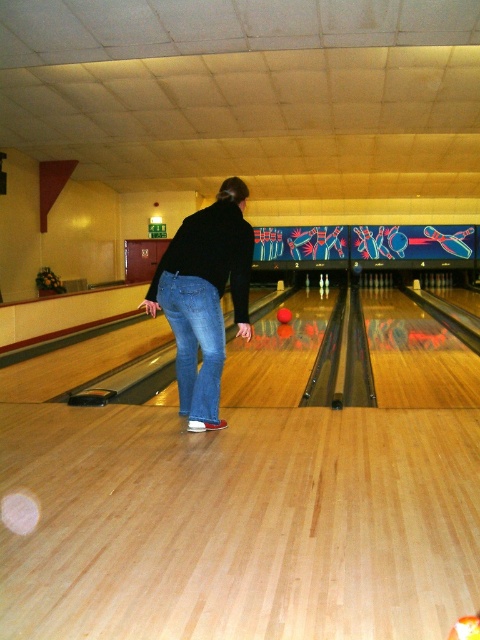
Does jeans at center appear over denim jeans at center?

Indeed, jeans at center is positioned over denim jeans at center.

Who is positioned more to the left, jeans at center or denim jeans at center?

denim jeans at center

Does point (205, 422) lie behind point (187, 339)?

No.

Locate an element on the screen. jeans at center is located at coordinates (204, 298).